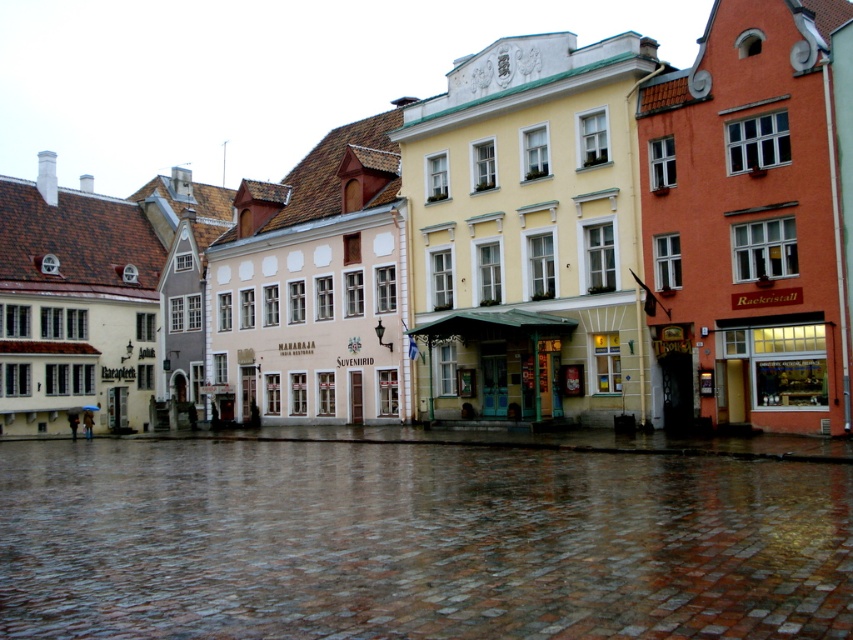
You are standing at the center of the European street scene and want to walk to the point that is closer to the buildings. Which point should you head towards, point (730, 387) or point (466, 330)?

You should head towards point (466, 330) because it is behind point (730, 387), making it closer to the buildings.

You are standing in the middle of the cobblestone street in the European town square. You notice two points marked on the ground at coordinates point (x=618, y=620) and point (x=775, y=332). Which of these points is closer to you?

Point (x=618, y=620) is closer to the viewer than point (x=775, y=332).